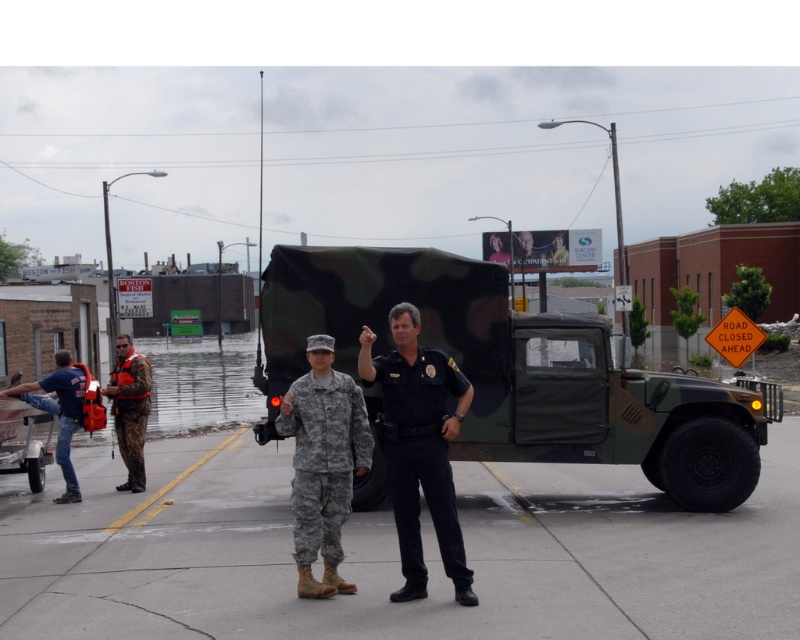
You are a photographer trying to capture both the camouflage fabric uniform at center and the camouflage fabric uniform at left in a single frame. Based on their positions, which one should you adjust your camera angle to focus on first to ensure both are in the frame?

Since the camouflage fabric uniform at center might be wider than the camouflage fabric uniform at left, you should focus on the camouflage fabric uniform at center first to accommodate its wider size in the frame.

You are a city planner assessing flood damage. You need to place a temporary barrier between the camouflage fabric truck at center and the blue denim jeans at lower left. Which object requires the barrier to be closer to it due to its smaller size?

The camouflage fabric truck at center requires the barrier to be closer to it because its width is less than the blue denim jeans at lower left, making it necessary to position the barrier nearer to accommodate its smaller size.

You are a drone operator tasked with capturing aerial footage of the scene. The drone has a maximum operational range of 30 feet. Can the drone safely capture footage of the camouflage fabric truck at center from its current position?

The camouflage fabric truck at center is 29.31 feet away from the camera, which is within the drone operator maximum operational range of 30 feet. Therefore, the drone can safely capture footage of the camouflage fabric truck at center.